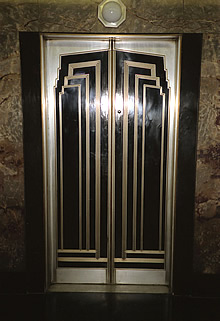
Where is `design cracks in the wall`? design cracks in the wall is located at coordinates [158, 25], [202, 201], [210, 154], [14, 207], [16, 174], [11, 73], [7, 99], [30, 23].